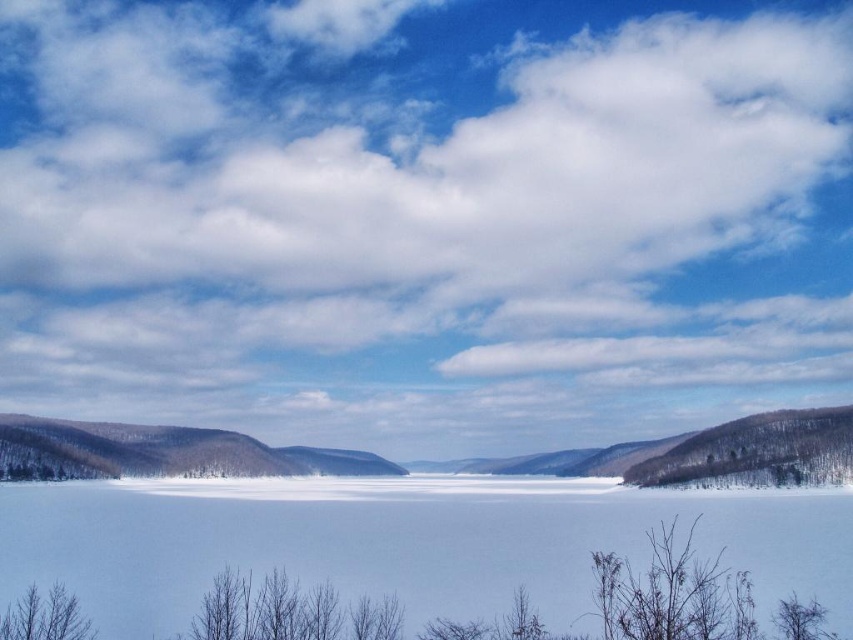
Question: Which point appears farthest from the camera in this image?

Choices:
 (A) (433, 573)
 (B) (793, 451)
 (C) (769, 312)
 (D) (94, 474)

Answer: (C)

Question: Can you confirm if white fluffy cloud at upper center is bigger than brown textured mountain at center?

Choices:
 (A) no
 (B) yes

Answer: (B)

Question: Does bare branches at lower right appear over brown bare branches at lower left?

Choices:
 (A) no
 (B) yes

Answer: (A)

Question: Does bare branches at lower right appear under brown bare branches at lower left?

Choices:
 (A) yes
 (B) no

Answer: (A)

Question: Which object is farther from the camera taking this photo?

Choices:
 (A) snowy brown hillside at right
 (B) brown bare branches at lower left
 (C) bare branches at lower right
 (D) white fluffy cloud at upper center

Answer: (D)

Question: Which object is farther from the camera taking this photo?

Choices:
 (A) snowy brown hillside at right
 (B) white ice at center
 (C) white fluffy cloud at upper center

Answer: (C)